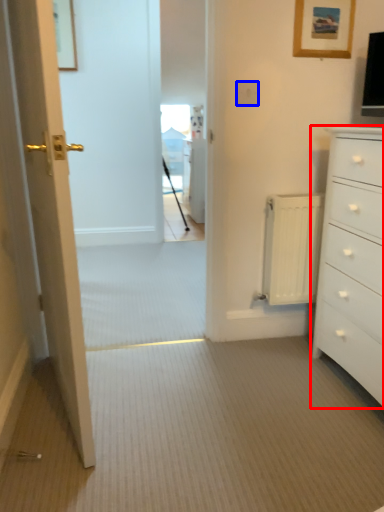
Question: Which of the following is the closest to the observer, chest of drawers (highlighted by a red box) or electric outlet (highlighted by a blue box)?

Choices:
 (A) chest of drawers
 (B) electric outlet

Answer: (A)